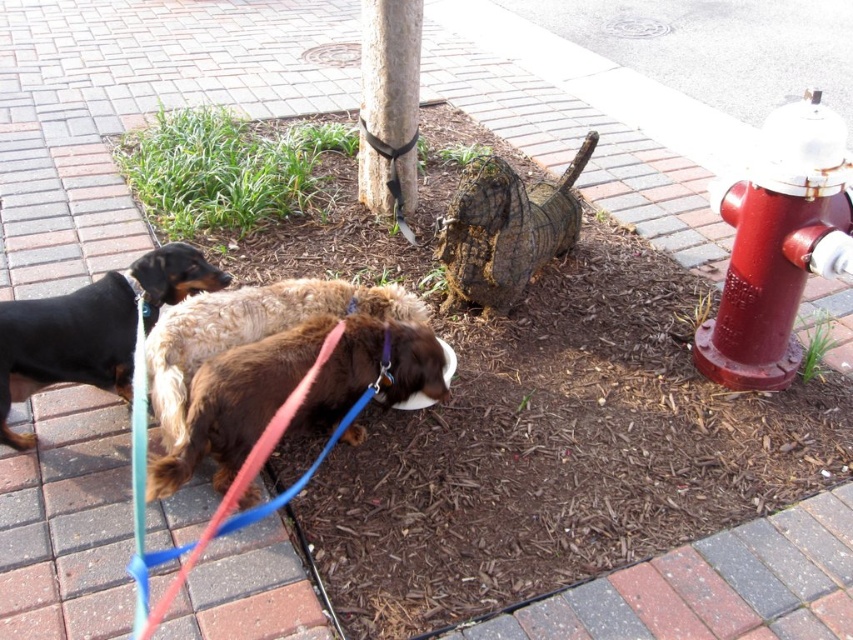
Question: Can you confirm if brown fuzzy dog at center is positioned above black smooth dog at left?

Choices:
 (A) yes
 (B) no

Answer: (B)

Question: Which point is closer to the camera taking this photo?

Choices:
 (A) (386, 84)
 (B) (405, 362)

Answer: (B)

Question: Is brown fuzzy dog at center thinner than black smooth dog at left?

Choices:
 (A) yes
 (B) no

Answer: (B)

Question: Which point appears closest to the camera in this image?

Choices:
 (A) (378, 182)
 (B) (354, 374)

Answer: (B)

Question: Can you confirm if red metallic hydrant at right is positioned to the left of black smooth dog at left?

Choices:
 (A) no
 (B) yes

Answer: (A)

Question: Which is farther from the black smooth dog at left?

Choices:
 (A) smooth brown pole at center
 (B) red metallic hydrant at right
 (C) brown fuzzy dog at center

Answer: (B)